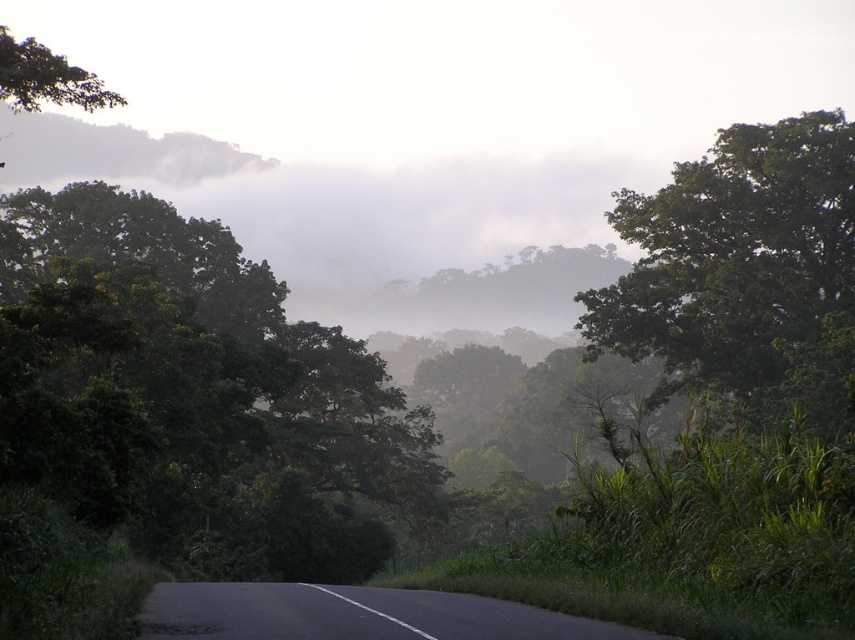
Question: Which of the following is the farthest from the observer?

Choices:
 (A) green leafy tree at left
 (B) green leafy tree at upper left
 (C) green leafy tree at upper right

Answer: (C)

Question: Is green leafy tree at left further to the viewer compared to green leafy tree at upper left?

Choices:
 (A) no
 (B) yes

Answer: (A)

Question: Which point appears farthest from the camera in this image?

Choices:
 (A) (107, 243)
 (B) (615, 195)

Answer: (B)

Question: Can you confirm if green leafy tree at upper right is positioned to the left of green leafy tree at upper left?

Choices:
 (A) yes
 (B) no

Answer: (B)

Question: Is green leafy tree at left to the right of green leafy tree at upper right from the viewer's perspective?

Choices:
 (A) no
 (B) yes

Answer: (A)

Question: Estimate the real-world distances between objects in this image. Which object is closer to the green leafy tree at upper right?

Choices:
 (A) green leafy tree at left
 (B) green leafy tree at upper left

Answer: (A)